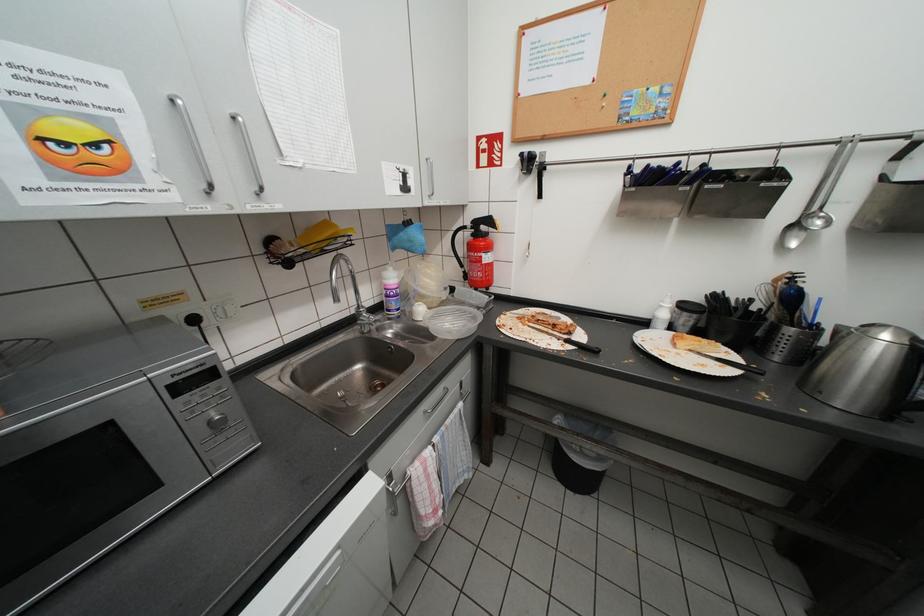
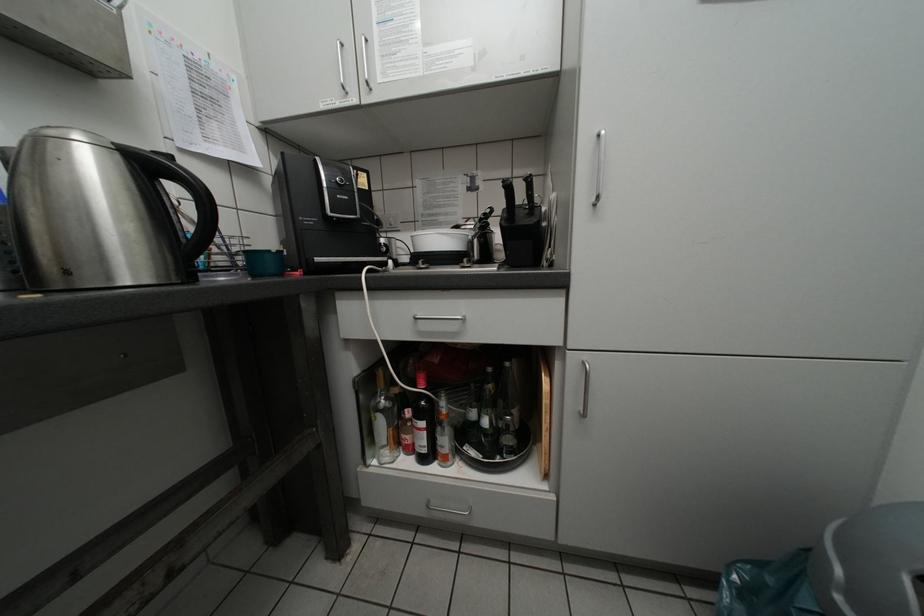
How did the camera likely rotate?

The camera rotated toward right-down.